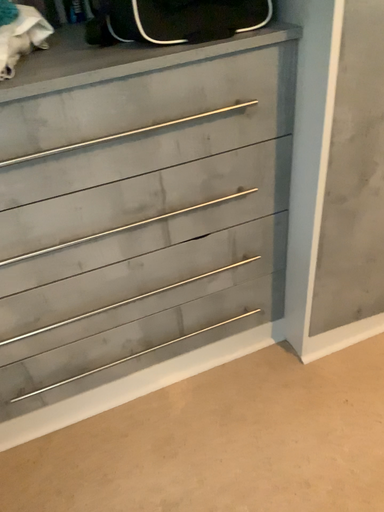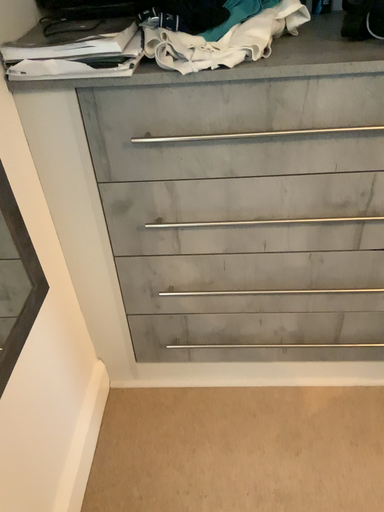
Question: Which way did the camera rotate in the video?

Choices:
 (A) rotated left
 (B) rotated right

Answer: (A)